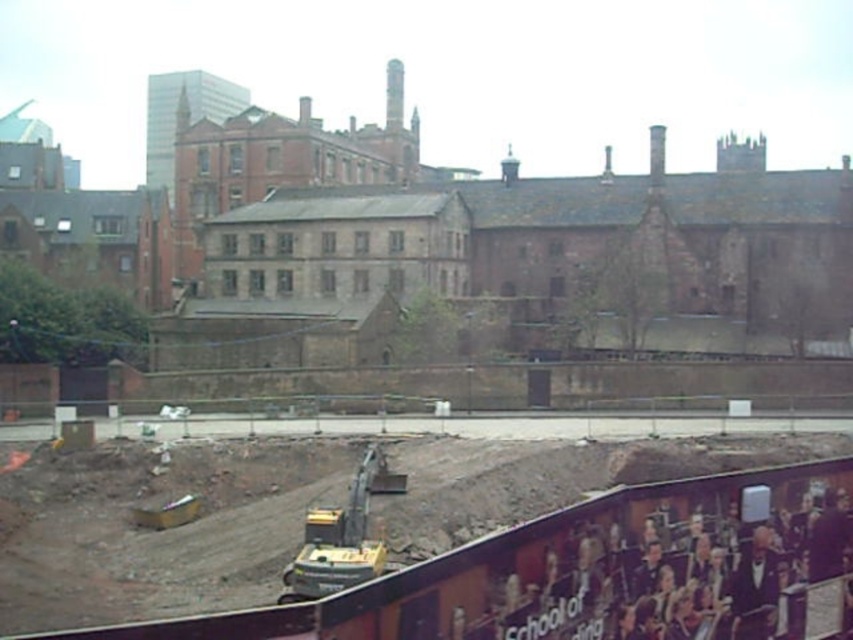
Question: Which of the following is the closest to the observer?

Choices:
 (A) brown dirt track at lower center
 (B) yellow metallic excavator at center

Answer: (A)

Question: Where is brown dirt track at lower center located in relation to yellow metallic excavator at center in the image?

Choices:
 (A) below
 (B) above

Answer: (B)

Question: Is brown dirt track at lower center smaller than yellow metallic excavator at center?

Choices:
 (A) no
 (B) yes

Answer: (A)

Question: Does brown dirt track at lower center have a lesser width compared to yellow metallic excavator at center?

Choices:
 (A) no
 (B) yes

Answer: (A)